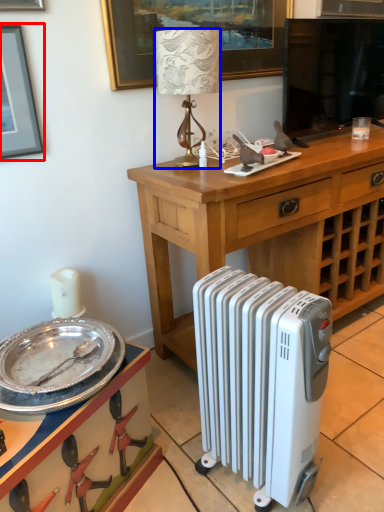
Question: Among these objects, which one is nearest to the camera, picture frame (highlighted by a red box) or lamp (highlighted by a blue box)?

Choices:
 (A) picture frame
 (B) lamp

Answer: (A)